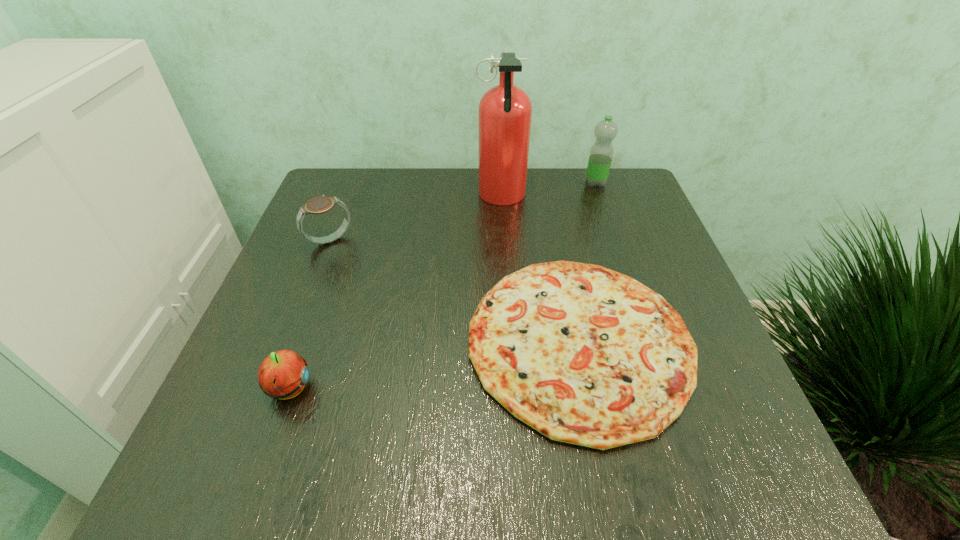
I want to click on vacant space at the far edge of the desktop, so click(502, 211).

What are the coordinates of `vacant area at the near edge of the desktop` in the screenshot? It's located at (430, 444).

The image size is (960, 540). What are the coordinates of `vacant space at the left edge of the desktop` in the screenshot? It's located at (348, 231).

Image resolution: width=960 pixels, height=540 pixels. Identify the location of free spot at the right edge of the desktop. (682, 280).

Identify the location of vacant space at the far left corner of the desktop. This screenshot has height=540, width=960. (372, 199).

In the image, there is a desktop. Where is `free space at the far right corner`? The width and height of the screenshot is (960, 540). free space at the far right corner is located at coordinates (591, 210).

This screenshot has height=540, width=960. Identify the location of free area in between the tallest object and the watch. (416, 219).

You are a GUI agent. You are given a task and a screenshot of the screen. Output one action in this format:
    pyautogui.click(x=<x>, y=<y>)
    Task: Click on the free space between the apple and the pizza
    
    Given the screenshot: What is the action you would take?
    pyautogui.click(x=435, y=366)

The height and width of the screenshot is (540, 960). What are the coordinates of `blank region between the apple and the water bottle` in the screenshot? It's located at (443, 286).

At what (x,y) coordinates should I click in order to perform the action: click on free space between the third shortest object and the fire extinguisher. Please return your answer as a coordinate pair (x, y). The height and width of the screenshot is (540, 960). Looking at the image, I should click on (416, 219).